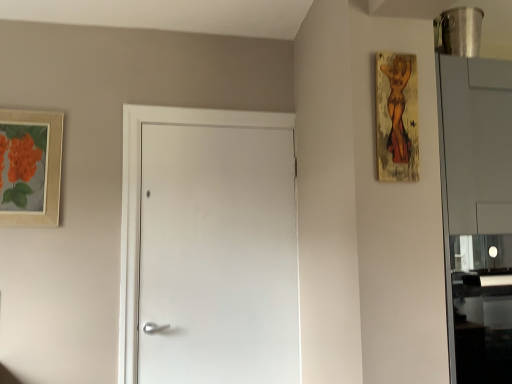
Question: Is point (26, 168) positioned closer to the camera than point (412, 107)?

Choices:
 (A) farther
 (B) closer

Answer: (A)

Question: Would you say matte wooden picture frame at upper left, acting as the second picture frame starting from the right, is to the left or to the right of wooden textured painting at upper right, the 2th picture frame viewed from the left, in the picture?

Choices:
 (A) right
 (B) left

Answer: (B)

Question: Based on their relative distances, which object is farther from the wooden textured painting at upper right, marked as the first picture frame in a right-to-left arrangement?

Choices:
 (A) white matte door at center
 (B) matte wooden picture frame at upper left, the first picture frame positioned from the back

Answer: (B)

Question: Considering the real-world distances, which object is closest to the matte wooden picture frame at upper left, the first picture frame positioned from the back?

Choices:
 (A) wooden textured painting at upper right, marked as the first picture frame in a right-to-left arrangement
 (B) white matte door at center

Answer: (B)